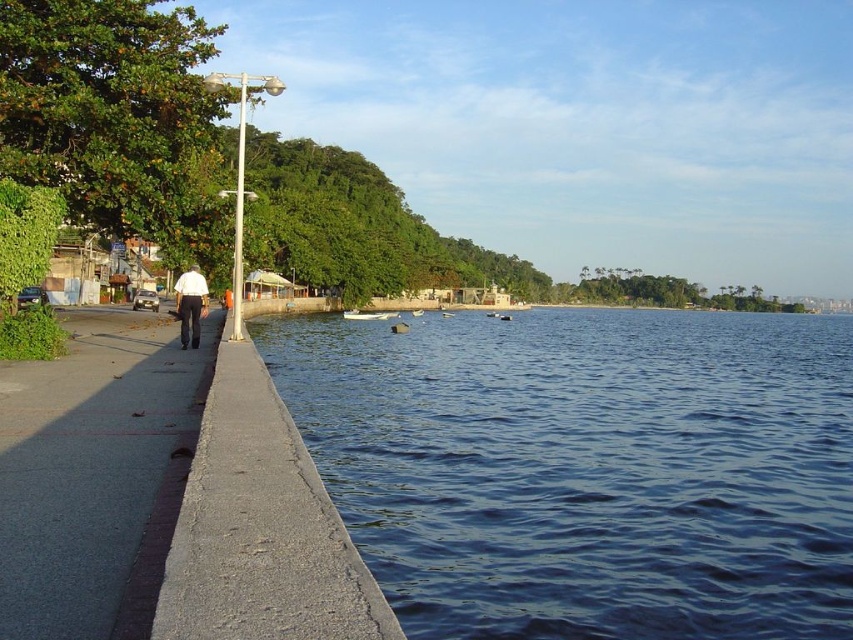
Question: Can you confirm if dark blue water at lower left is wider than metallic pole at left?

Choices:
 (A) no
 (B) yes

Answer: (B)

Question: Does dark blue water at lower left lie behind white shirt at left?

Choices:
 (A) yes
 (B) no

Answer: (B)

Question: Which is nearer to the metallic pole at left?

Choices:
 (A) gray concrete sidewalk at left
 (B) dark blue water at lower left
 (C) white shirt at left

Answer: (A)

Question: Observing the image, what is the correct spatial positioning of gray concrete sidewalk at left in reference to metallic pole at left?

Choices:
 (A) right
 (B) left

Answer: (A)

Question: Which point appears closest to the camera in this image?

Choices:
 (A) (231, 304)
 (B) (9, 625)

Answer: (B)

Question: Estimate the real-world distances between objects in this image. Which object is closer to the gray concrete sidewalk at left?

Choices:
 (A) white shirt at left
 (B) metallic pole at left
 (C) dark blue water at lower left

Answer: (A)